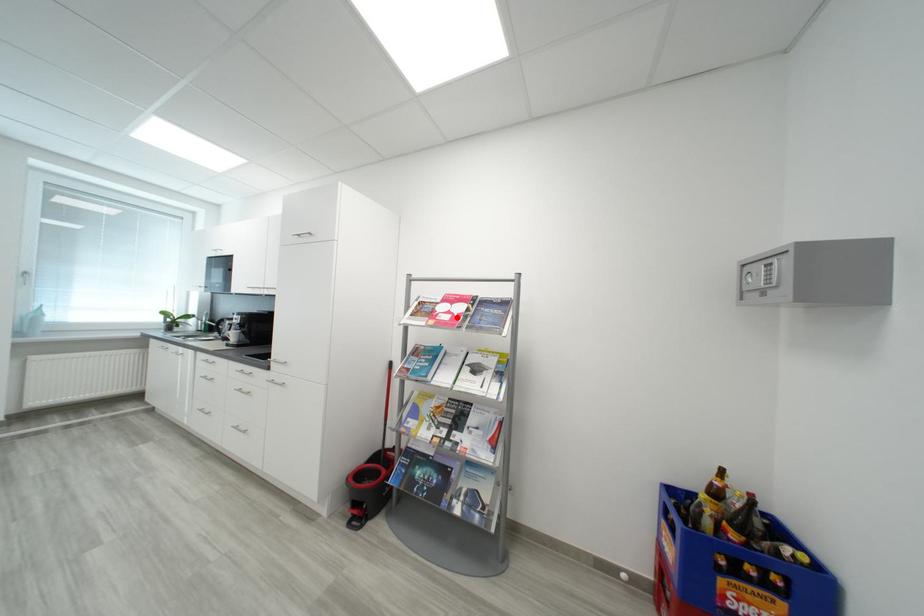
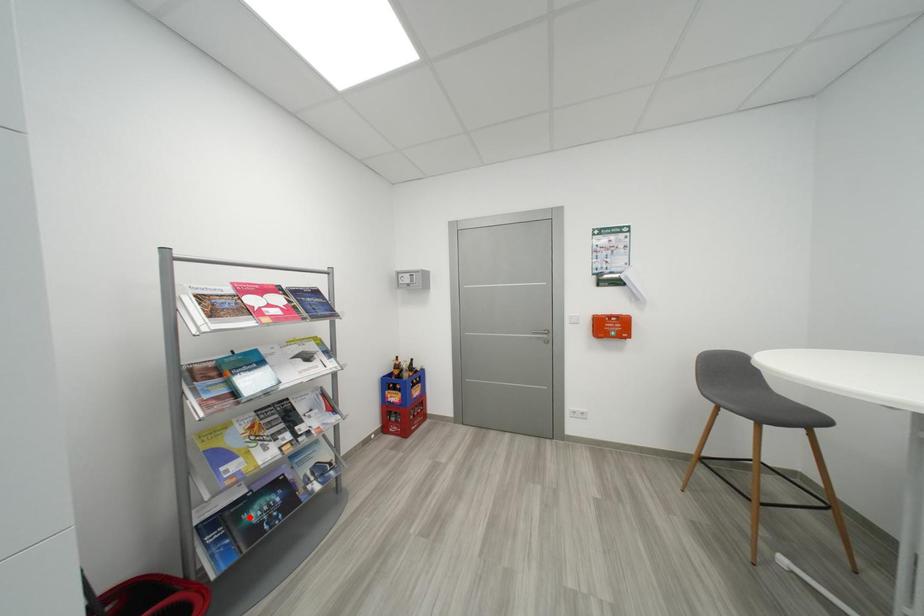
I am providing you with two images of the same scene from different viewpoints. A red point is marked on the first image and another point is marked on the second image. Are the points marked in image1 and image2 representing the same 3D position?

No